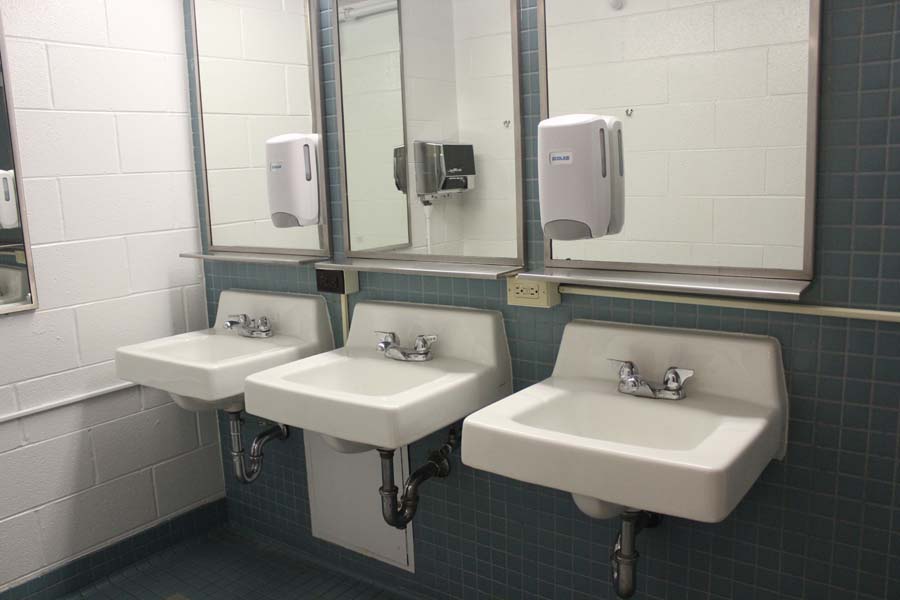
Find the location of `access panel for plumbing`. access panel for plumbing is located at coordinates (337, 502).